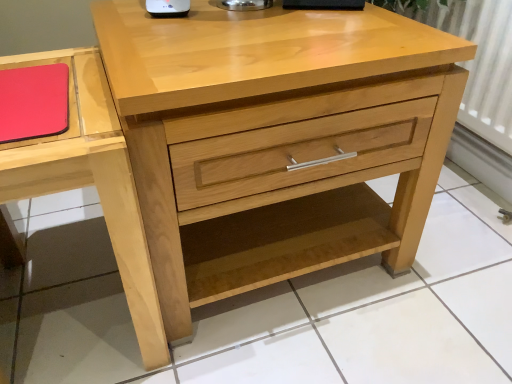
You are a GUI agent. You are given a task and a screenshot of the screen. Output one action in this format:
    pyautogui.click(x=<x>, y=<y>)
    Task: Click on the vacant space underneath matte wood vanity at left (from a real-world perspective)
    The height and width of the screenshot is (384, 512).
    Given the screenshot: What is the action you would take?
    pyautogui.click(x=73, y=311)